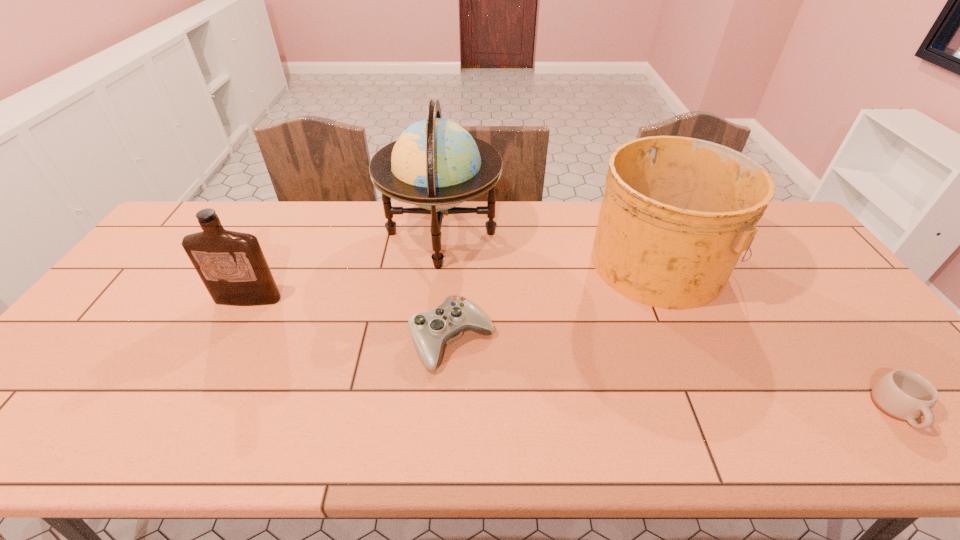
At what (x,y) coordinates should I click in order to perform the action: click on the tallest object. Please return your answer as a coordinate pair (x, y). Image resolution: width=960 pixels, height=540 pixels. Looking at the image, I should click on (436, 164).

The height and width of the screenshot is (540, 960). Identify the location of bucket. (677, 213).

Image resolution: width=960 pixels, height=540 pixels. I want to click on the leftmost object, so click(232, 266).

Image resolution: width=960 pixels, height=540 pixels. I want to click on control, so click(x=430, y=330).

The width and height of the screenshot is (960, 540). In order to click on the rightmost object in this screenshot , I will do `click(904, 395)`.

You are a GUI agent. You are given a task and a screenshot of the screen. Output one action in this format:
    pyautogui.click(x=<x>, y=<y>)
    Task: Click on the nearest object
    This screenshot has width=960, height=540.
    Given the screenshot: What is the action you would take?
    pyautogui.click(x=904, y=395)

The height and width of the screenshot is (540, 960). I want to click on vacant space situated on the surface of the tallest object, so click(593, 233).

You are a GUI agent. You are given a task and a screenshot of the screen. Output one action in this format:
    pyautogui.click(x=<x>, y=<y>)
    Task: Click on the free spot located 0.350m on the front of the second object from right to left
    
    Given the screenshot: What is the action you would take?
    pyautogui.click(x=735, y=431)

Locate an element on the screen. The height and width of the screenshot is (540, 960). vacant space located 0.380m on the label side of the leftmost object is located at coordinates (176, 436).

Where is `free space located on the front of the control`? free space located on the front of the control is located at coordinates (448, 417).